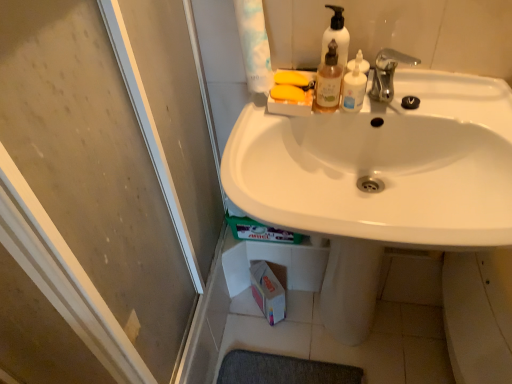
You are a GUI agent. You are given a task and a screenshot of the screen. Output one action in this format:
    pyautogui.click(x=<x>, y=<y>)
    Task: Click on the vacant space in front of white glossy toilet paper at upper center
    The image size is (512, 384).
    Given the screenshot: What is the action you would take?
    pyautogui.click(x=250, y=132)